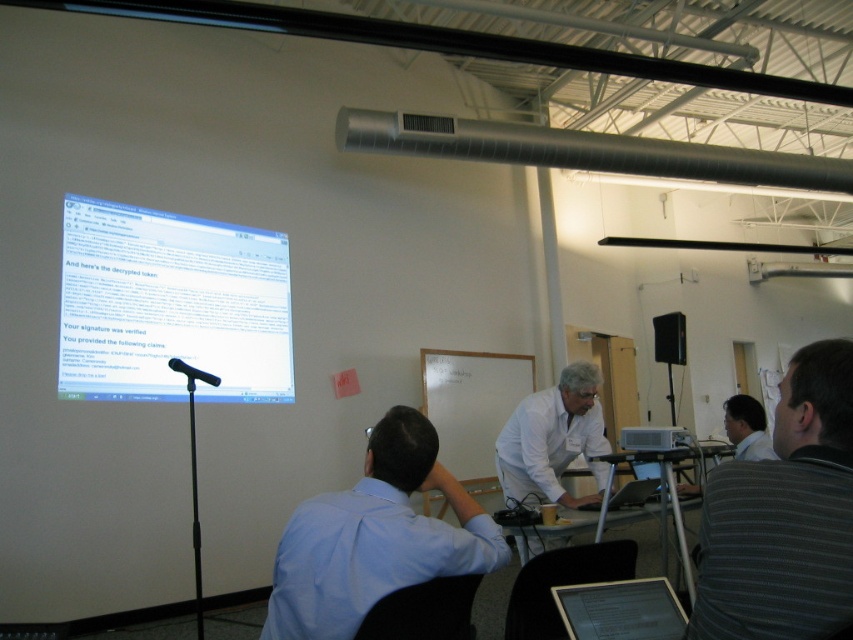
Question: Is light blue shirt at center thinner than white matte shirt at center?

Choices:
 (A) yes
 (B) no

Answer: (A)

Question: Can you confirm if white glossy projector screen at upper left is positioned above black matte microphone at left?

Choices:
 (A) yes
 (B) no

Answer: (A)

Question: Which of the following is the closest to the observer?

Choices:
 (A) (583, 442)
 (B) (672, 321)
 (C) (608, 504)

Answer: (C)

Question: Among these objects, which one is farthest from the camera?

Choices:
 (A) black plastic speaker at upper right
 (B) black matte microphone at left
 (C) white plastic projector at center
 (D) gray striped shirt at upper right

Answer: (A)

Question: Can you confirm if metallic silver table at center is wider than silver metallic laptop at center?

Choices:
 (A) yes
 (B) no

Answer: (A)

Question: Which point appears farthest from the camera in this image?

Choices:
 (A) (440, 532)
 (B) (650, 428)
 (C) (606, 486)
 (D) (518, 467)

Answer: (B)